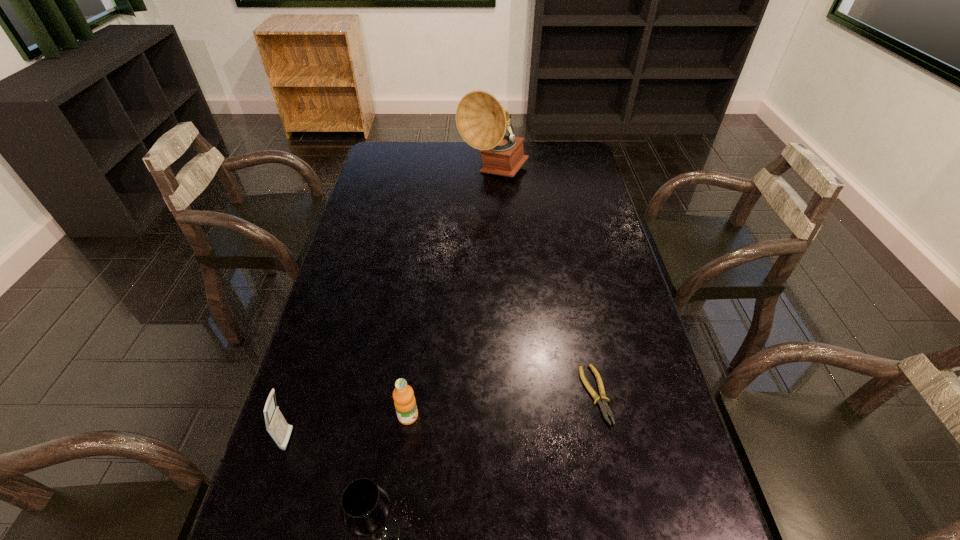
Find the location of a particular element. This screenshot has height=540, width=960. vacant space located 0.230m on the label of the orange juice is located at coordinates (516, 438).

This screenshot has width=960, height=540. I want to click on vacant space positioned 0.400m on the front-facing side of the second nearest object, so click(x=472, y=443).

Image resolution: width=960 pixels, height=540 pixels. Identify the location of free space located 0.080m on the front-facing side of the second nearest object. (330, 440).

The height and width of the screenshot is (540, 960). Identify the location of free space located 0.150m on the front-facing side of the second nearest object. (361, 441).

The image size is (960, 540). I want to click on vacant region located on the horn of the farthest object, so tap(498, 252).

The width and height of the screenshot is (960, 540). I want to click on free region located on the horn of the farthest object, so click(498, 262).

Locate an element on the screen. The height and width of the screenshot is (540, 960). vacant area situated on the horn of the farthest object is located at coordinates (498, 258).

Locate an element on the screen. This screenshot has height=540, width=960. object present at the far edge is located at coordinates (481, 120).

This screenshot has width=960, height=540. In order to click on object located in the left edge section of the desktop in this screenshot , I will do `click(276, 425)`.

Find the location of a particular element. Image resolution: width=960 pixels, height=540 pixels. object present at the right edge is located at coordinates (604, 408).